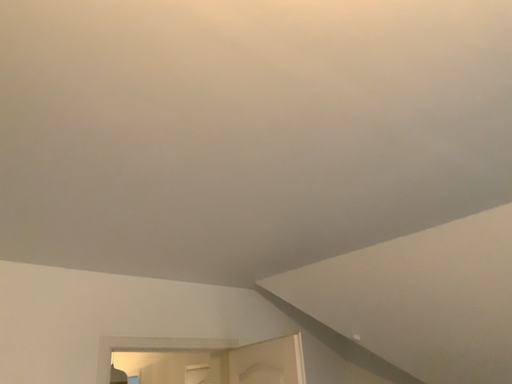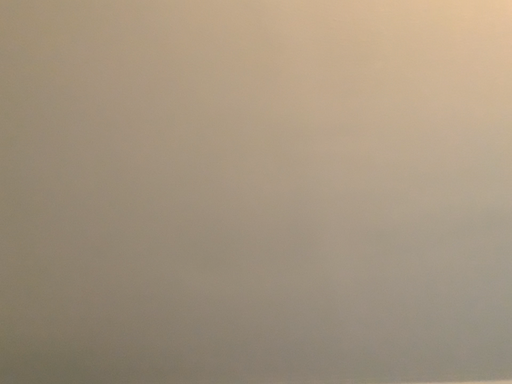
Question: How did the camera likely rotate when shooting the video?

Choices:
 (A) rotated upward
 (B) rotated downward

Answer: (A)